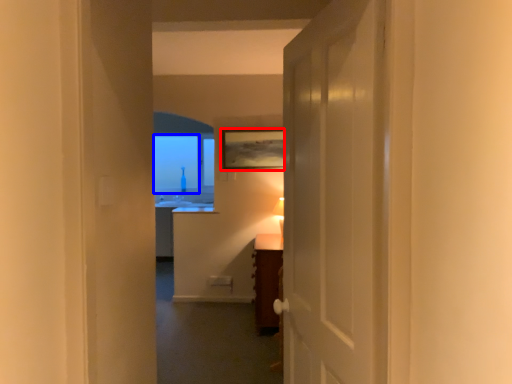
Question: Which object is further to the camera taking this photo, picture frame (highlighted by a red box) or window screen (highlighted by a blue box)?

Choices:
 (A) picture frame
 (B) window screen

Answer: (B)